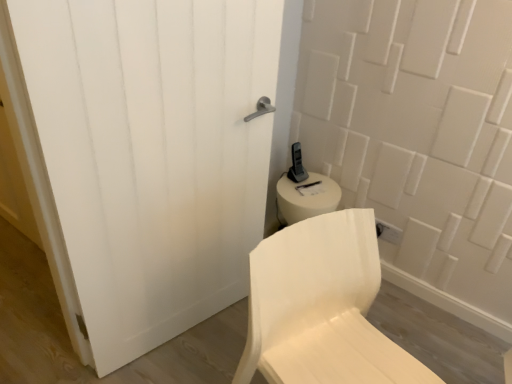
Question: From a real-world perspective, is white matte door at center physically located above or below white matte chair at center?

Choices:
 (A) below
 (B) above

Answer: (B)

Question: Is white matte door at center to the left or to the right of white matte chair at center in the image?

Choices:
 (A) right
 (B) left

Answer: (B)

Question: Considering the positions of point (246, 180) and point (330, 246), is point (246, 180) closer or farther from the camera than point (330, 246)?

Choices:
 (A) farther
 (B) closer

Answer: (A)

Question: Is white matte chair at center inside or outside of white matte door at center?

Choices:
 (A) inside
 (B) outside

Answer: (B)

Question: Considering the positions of point (399, 372) and point (252, 54), is point (399, 372) closer or farther from the camera than point (252, 54)?

Choices:
 (A) closer
 (B) farther

Answer: (A)

Question: From a real-world perspective, is white matte chair at center above or below white matte door at center?

Choices:
 (A) below
 (B) above

Answer: (A)

Question: Based on their sizes in the image, would you say white matte chair at center is bigger or smaller than white matte door at center?

Choices:
 (A) big
 (B) small

Answer: (A)